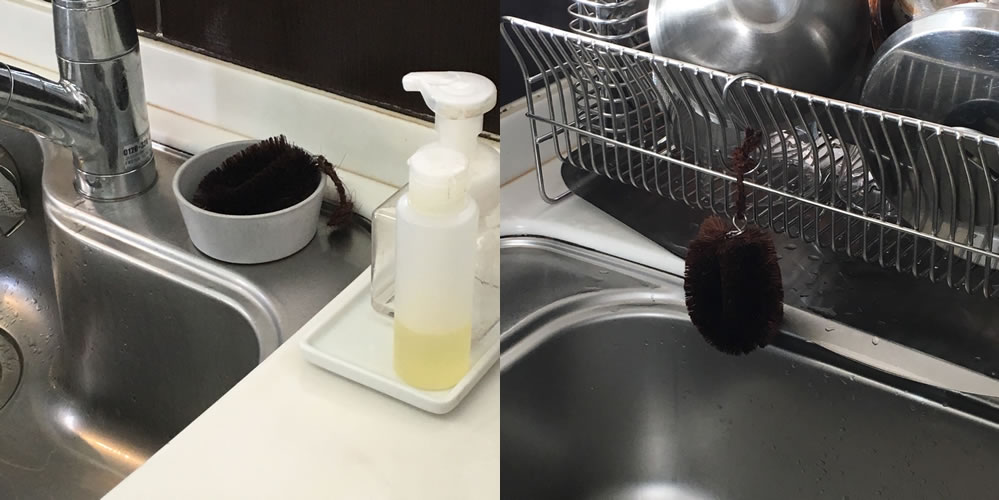
The height and width of the screenshot is (500, 999). I want to click on inside of sink, so click(x=49, y=395), click(x=627, y=426).